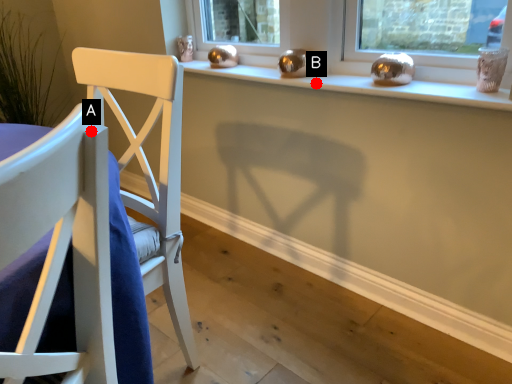
Question: Two points are circled on the image, labeled by A and B beside each circle. Which point is further to the camera?

Choices:
 (A) A is further
 (B) B is further

Answer: (B)